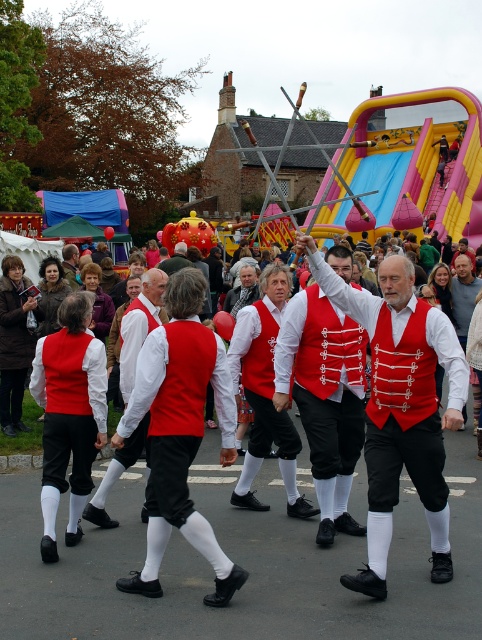
Question: Among these points, which one is nearest to the camera?

Choices:
 (A) (371, 566)
 (B) (172, 268)

Answer: (A)

Question: Does matte red vest at center have a smaller size compared to red velvet vest at center?

Choices:
 (A) yes
 (B) no

Answer: (A)

Question: Is matte red vest at center above red velvet vest at center?

Choices:
 (A) yes
 (B) no

Answer: (B)

Question: Which point appears farthest from the camera in this image?

Choices:
 (A) [x=176, y=253]
 (B) [x=361, y=294]

Answer: (A)

Question: Considering the relative positions of matte red vest at center and red velvet vest at center in the image provided, where is matte red vest at center located with respect to red velvet vest at center?

Choices:
 (A) below
 (B) above

Answer: (A)

Question: Which point is closer to the camera?

Choices:
 (A) red velvet vest at center
 (B) matte red vest at center

Answer: (B)